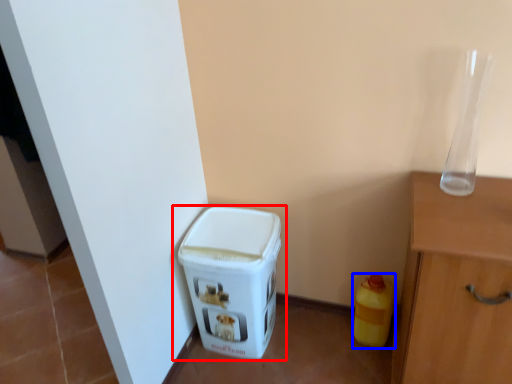
Question: Which point is closer to the camera, waste container (highlighted by a red box) or bottle (highlighted by a blue box)?

Choices:
 (A) waste container
 (B) bottle

Answer: (A)